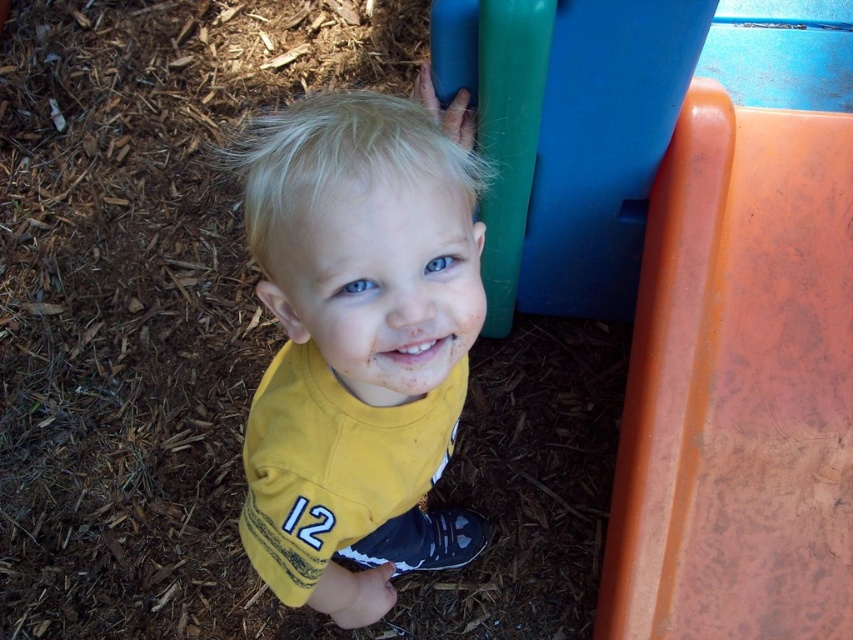
You are a photographer trying to capture a photo of the orange matte slide at right and the yellow fabric shirt at center. From the camera position, which object appears closer to the camera?

The orange matte slide at right is located below the yellow fabric shirt at center, so the yellow fabric shirt at center appears closer to the camera.

You are a photographer standing at the center of the playground. You want to take a photo of the orange matte slide at right and the yellow fabric shirt at center so that both are clearly visible in the frame. Given that your camera has a maximum focus range of 18 inches, will you be able to capture both objects in focus?

The orange matte slide at right and yellow fabric shirt at center are 18.86 inches apart. Since the distance between them exceeds the camera maximum focus range of 18 inches, the camera cannot focus on both objects simultaneously. You might need to adjust your position or use a different camera setting to ensure both are in focus.

You are a photographer setting up for a photo shoot at a playground. You need to position the orange matte slide at right and the yellow fabric shirt at center in such a way that they are both visible in the frame. Considering their sizes, which object should you place closer to the camera to ensure both are fully visible?

The orange matte slide at right is smaller than the yellow fabric shirt at center, so to ensure both are fully visible in the frame, you should place the orange matte slide at right closer to the camera. This will help compensate for its smaller size, allowing it to appear larger in the photo and maintain balance with the yellow fabric shirt at center.